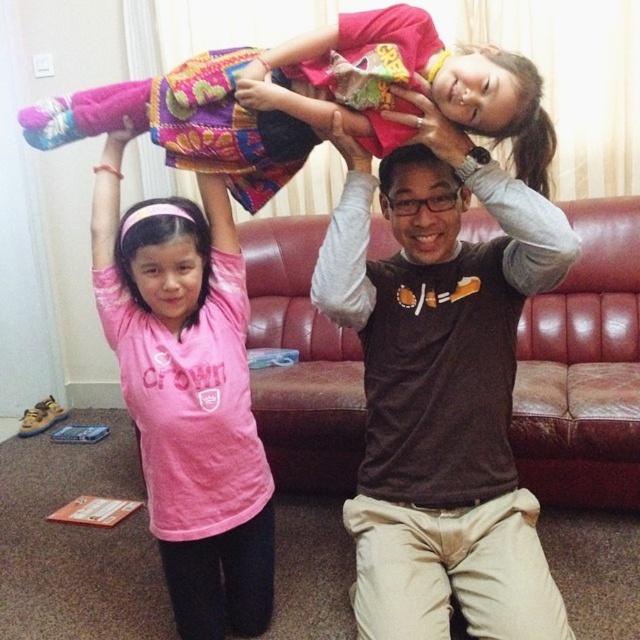
The height and width of the screenshot is (640, 640). What do you see at coordinates (442, 388) in the screenshot?
I see `brown matte shirt at center` at bounding box center [442, 388].

Between brown matte shirt at center and pink matte shirt at center, which one has more height?

pink matte shirt at center is taller.

Is point (404, 625) closer to camera compared to point (102, 160)?

Yes, point (404, 625) is in front of point (102, 160).

I want to click on brown matte shirt at center, so click(442, 388).

Who is positioned more to the left, brown matte shirt at center or brown matte head at center?

brown matte head at center is more to the left.

Based on the photo, does brown matte shirt at center lie behind brown matte head at center?

No, brown matte shirt at center is in front of brown matte head at center.

Who is more forward, (509, 580) or (406, 214)?

Point (509, 580)

Locate an element on the screen. brown matte shirt at center is located at coordinates (442, 388).

Is point (452, 218) behind point (346, 104)?

Yes, point (452, 218) is behind point (346, 104).

Does brown matte shirt at center appear under multicolored fabric at upper center?

Yes.

I want to click on brown matte shirt at center, so click(x=442, y=388).